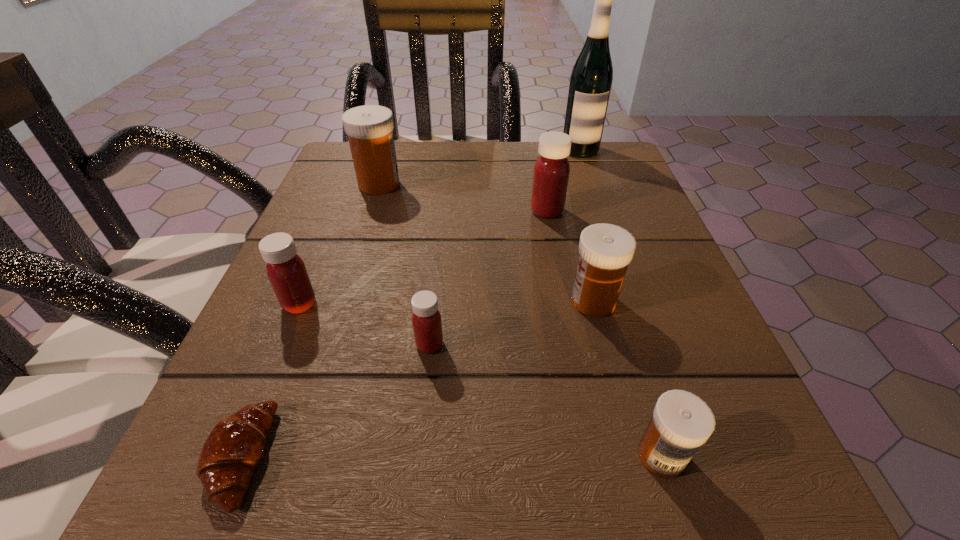
Identify the location of object that is at the near left corner. (233, 449).

Image resolution: width=960 pixels, height=540 pixels. In order to click on object that is at the far right corner in this screenshot , I will do `click(591, 78)`.

Where is `object at the near right corner`? The width and height of the screenshot is (960, 540). object at the near right corner is located at coordinates (681, 422).

This screenshot has width=960, height=540. In the image, there is a desktop. In order to click on vacant space at the far edge in this screenshot , I will do `click(473, 186)`.

Image resolution: width=960 pixels, height=540 pixels. In the image, there is a desktop. What are the coordinates of `free space at the near edge` in the screenshot? It's located at (396, 499).

The width and height of the screenshot is (960, 540). In order to click on free space at the left edge in this screenshot , I will do `click(365, 204)`.

Where is `free space at the right edge of the desktop`? This screenshot has height=540, width=960. free space at the right edge of the desktop is located at coordinates (626, 221).

You are a GUI agent. You are given a task and a screenshot of the screen. Output one action in this format:
    pyautogui.click(x=<x>, y=<y>)
    Task: Click on the blank space at the far left corner of the desktop
    This screenshot has height=540, width=960.
    Given the screenshot: What is the action you would take?
    pyautogui.click(x=400, y=153)

In the image, there is a desktop. In order to click on vacant space at the near right corner in this screenshot , I will do `click(715, 456)`.

Find the location of a particular element. free space between the second smallest white medicine and the farthest red medicine is located at coordinates (570, 256).